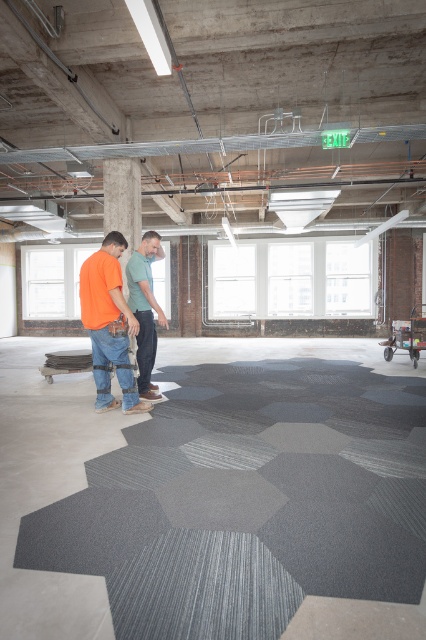
Is point (100, 262) in front of point (132, 259)?

Yes, it is.

Identify the location of matte orange shirt at center. The height and width of the screenshot is (640, 426). (109, 324).